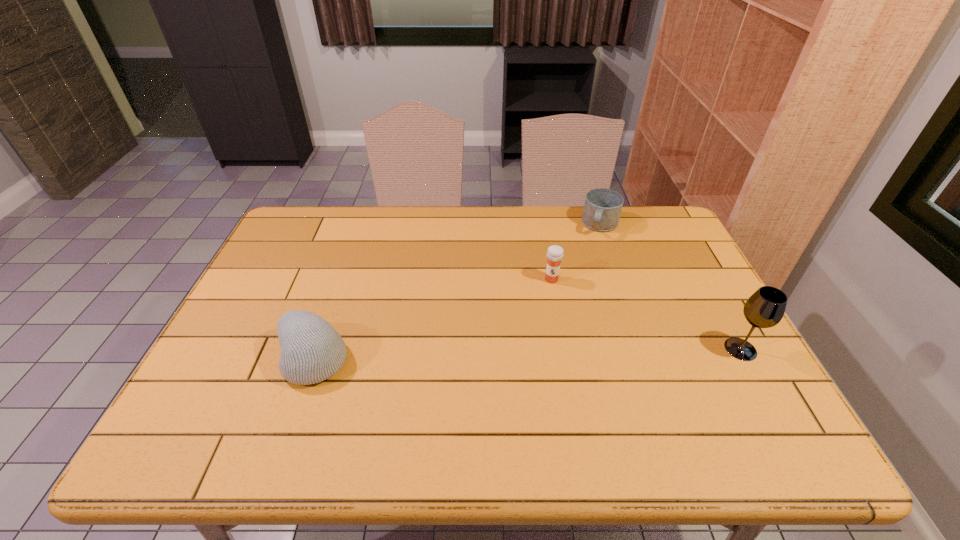
The image size is (960, 540). What are the coordinates of `vacant position located on the label side of the third object from right to left` in the screenshot? It's located at (532, 373).

Where is `blank space located 0.280m on the label side of the third object from right to left`? This screenshot has width=960, height=540. blank space located 0.280m on the label side of the third object from right to left is located at coordinates (535, 360).

This screenshot has height=540, width=960. Find the location of `free spot located 0.070m on the side of the third object from left to right with the handle`. free spot located 0.070m on the side of the third object from left to right with the handle is located at coordinates (593, 251).

Find the location of `vacant space situated 0.350m on the side of the third object from left to right with the handle`. vacant space situated 0.350m on the side of the third object from left to right with the handle is located at coordinates (570, 309).

Locate an element on the screen. This screenshot has width=960, height=540. free space located 0.180m on the side of the third object from left to right with the handle is located at coordinates (586, 272).

This screenshot has width=960, height=540. I want to click on object that is at the far edge, so click(x=602, y=208).

The height and width of the screenshot is (540, 960). I want to click on object that is at the near edge, so click(312, 351).

Where is `object located in the right edge section of the desktop`? object located in the right edge section of the desktop is located at coordinates (765, 308).

In the image, there is a desktop. What are the coordinates of `vacant space at the far edge` in the screenshot? It's located at (630, 246).

I want to click on vacant region at the near edge of the desktop, so click(319, 404).